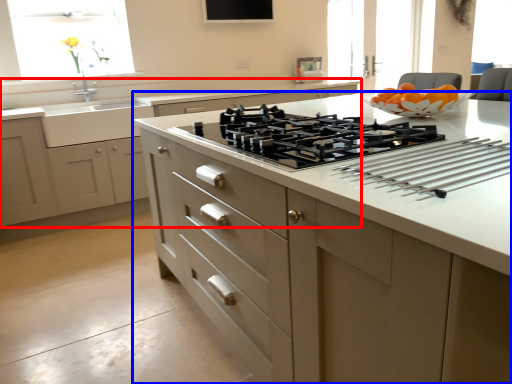
Question: Which object appears closest to the camera in this image, cabinetry (highlighted by a red box) or countertop (highlighted by a blue box)?

Choices:
 (A) cabinetry
 (B) countertop

Answer: (B)